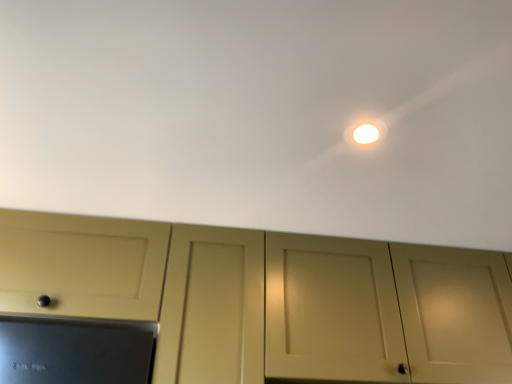
Question: Can you confirm if white glossy light at upper center is thinner than white matte ceiling at upper center?

Choices:
 (A) yes
 (B) no

Answer: (A)

Question: Does white glossy light at upper center have a lesser height compared to white matte ceiling at upper center?

Choices:
 (A) no
 (B) yes

Answer: (B)

Question: From the image's perspective, does white glossy light at upper center appear lower than white matte ceiling at upper center?

Choices:
 (A) no
 (B) yes

Answer: (A)

Question: Is white glossy light at upper center bigger than white matte ceiling at upper center?

Choices:
 (A) yes
 (B) no

Answer: (B)

Question: Is white matte ceiling at upper center completely or partially inside white glossy light at upper center?

Choices:
 (A) yes
 (B) no

Answer: (B)

Question: Looking at their shapes, would you say white glossy light at upper center is wider or thinner than white matte ceiling at upper center?

Choices:
 (A) thin
 (B) wide

Answer: (A)

Question: Would you say white glossy light at upper center is to the left or to the right of white matte ceiling at upper center in the picture?

Choices:
 (A) left
 (B) right

Answer: (B)

Question: Is white glossy light at upper center inside the boundaries of white matte ceiling at upper center, or outside?

Choices:
 (A) inside
 (B) outside

Answer: (A)

Question: Considering the positions of point (352, 140) and point (455, 148), is point (352, 140) closer or farther from the camera than point (455, 148)?

Choices:
 (A) farther
 (B) closer

Answer: (B)

Question: Is point (374, 352) closer or farther from the camera than point (373, 137)?

Choices:
 (A) farther
 (B) closer

Answer: (A)

Question: From their relative heights in the image, would you say matte cream cabinet at center is taller or shorter than white glossy light at upper center?

Choices:
 (A) short
 (B) tall

Answer: (B)

Question: From a real-world perspective, relative to white glossy light at upper center, is matte cream cabinet at center vertically above or below?

Choices:
 (A) above
 (B) below

Answer: (B)

Question: Considering the relative positions of matte cream cabinet at center and white glossy light at upper center in the image provided, is matte cream cabinet at center to the left or to the right of white glossy light at upper center?

Choices:
 (A) left
 (B) right

Answer: (B)

Question: In terms of width, does white matte ceiling at upper center look wider or thinner when compared to matte cream cabinet at center?

Choices:
 (A) wide
 (B) thin

Answer: (A)

Question: From a real-world perspective, is white matte ceiling at upper center physically located above or below matte cream cabinet at center?

Choices:
 (A) below
 (B) above

Answer: (B)